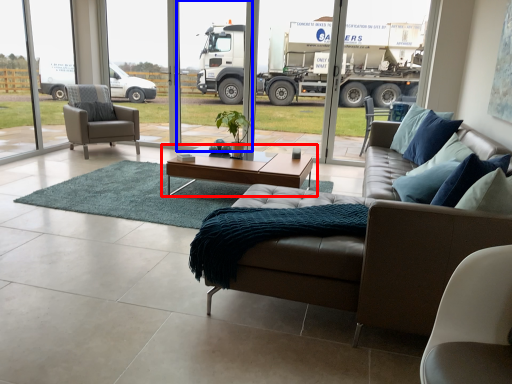
Question: Among these objects, which one is nearest to the camera, coffee table (highlighted by a red box) or screen door (highlighted by a blue box)?

Choices:
 (A) coffee table
 (B) screen door

Answer: (A)